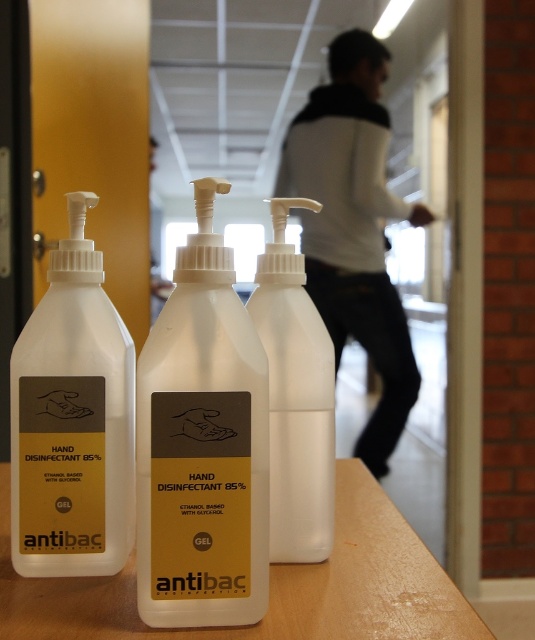
Is white matte hand sanitizer at left closer to camera compared to white plastic table at center?

No, it is behind white plastic table at center.

Is white matte hand sanitizer at left to the right of white plastic table at center from the viewer's perspective?

Incorrect, white matte hand sanitizer at left is not on the right side of white plastic table at center.

Where is `white matte hand sanitizer at left`? white matte hand sanitizer at left is located at coordinates (72, 420).

Where is `white matte hand sanitizer at left`? white matte hand sanitizer at left is located at coordinates (72, 420).

Can you confirm if white gel hand disinfectant at center is positioned below white plastic hand sanitizer at center?

Indeed, white gel hand disinfectant at center is positioned under white plastic hand sanitizer at center.

Consider the image. Is white gel hand disinfectant at center positioned behind white plastic hand sanitizer at center?

No, it is in front of white plastic hand sanitizer at center.

Who is more forward, (217, 472) or (271, 532)?

Point (217, 472) is more forward.

Locate an element on the screen. white gel hand disinfectant at center is located at coordinates (202, 445).

Is white gel hand disinfectant at center bigger than white matte hand sanitizer at center?

Actually, white gel hand disinfectant at center might be smaller than white matte hand sanitizer at center.

Measure the distance between point (174, 582) and camera.

Point (174, 582) and camera are 22.34 inches apart.

This screenshot has height=640, width=535. I want to click on white gel hand disinfectant at center, so click(202, 445).